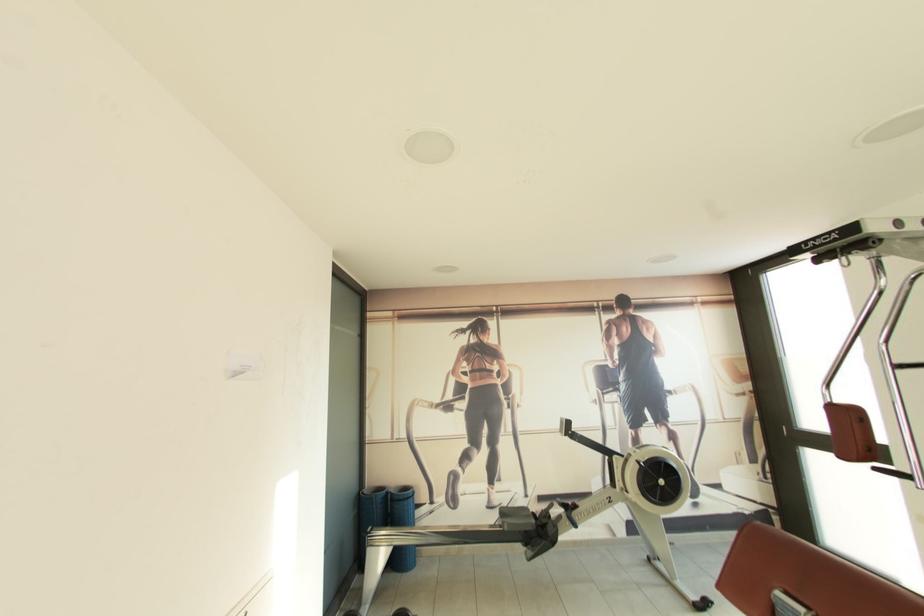
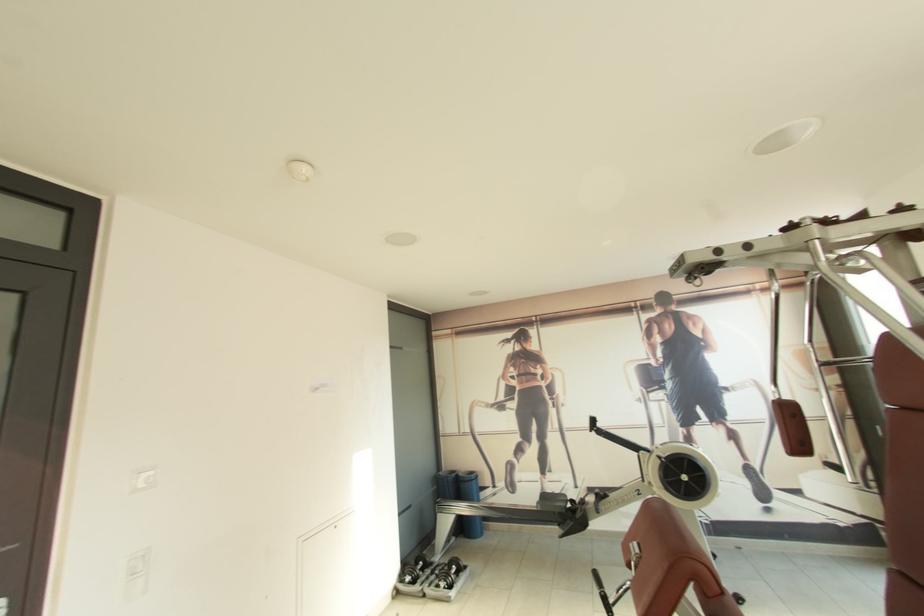
Find the pixel in the second image that matches pixel 410 490 in the first image.

(476, 475)